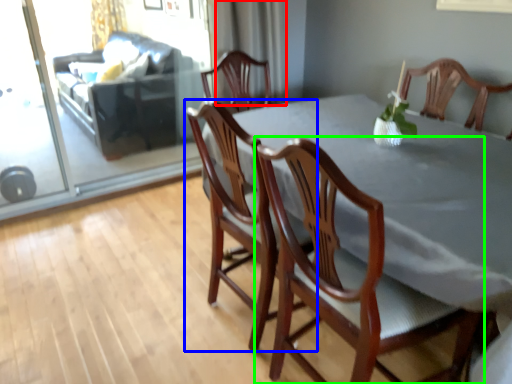
Question: Which is nearer to the curtain (highlighted by a red box)? chair (highlighted by a blue box) or chair (highlighted by a green box).

Choices:
 (A) chair
 (B) chair

Answer: (A)